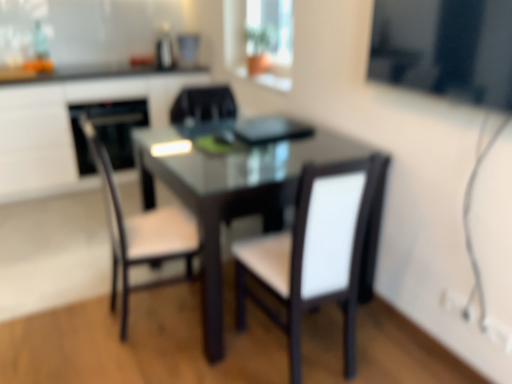
Where is `vacant region under white leather chair at center, the third chair positioned from the left (from a real-world perspective)`? vacant region under white leather chair at center, the third chair positioned from the left (from a real-world perspective) is located at coordinates (305, 352).